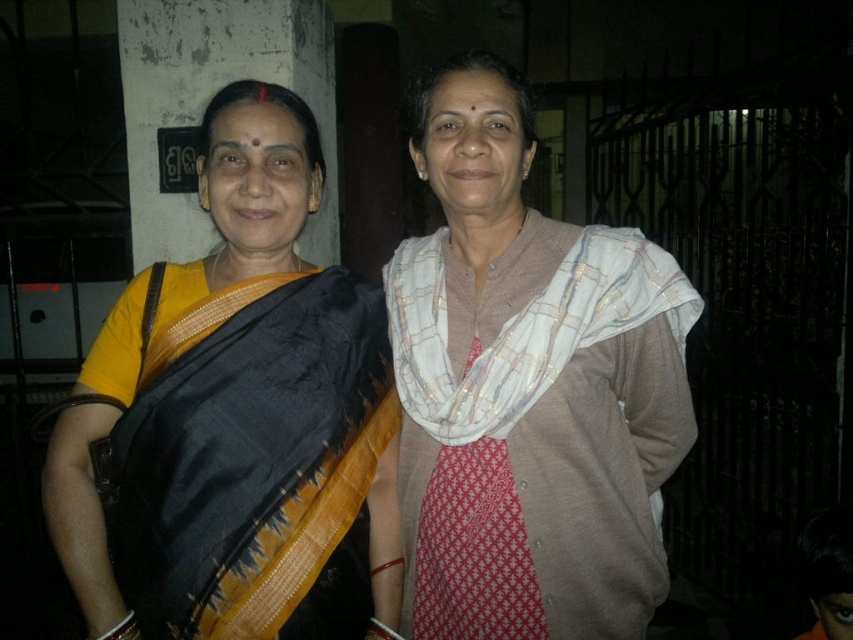
You are a photographer trying to capture a closeup shot of the woman on the left wearing the yellow border sari. You are currently positioned at point (132, 576) and want to move closer to her. If you move towards point (508, 422), will you get closer to the woman on the left?

Point (132, 576) is closer to the viewer than point (508, 422). Moving towards point (508, 422) would take you further away from the woman on the left wearing the yellow border sari.

You are a photographer setting up for a portrait. You need to ensure both scarves are visible in the frame. Given that the matte brown scarf at center is much taller than the white textured scarf at center, which scarf should you adjust the camera angle to focus on to include both in the composition?

Since the matte brown scarf at center is much taller than the white textured scarf at center, you should adjust the camera angle to focus on the matte brown scarf at center to ensure both are fully visible in the frame.